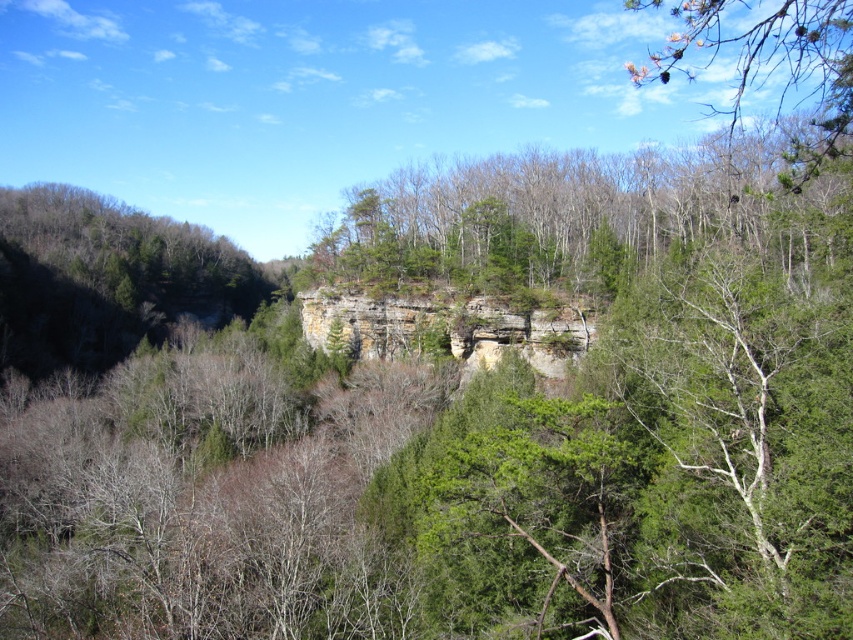
You are an artist sketching this landscape. You want to ensure the green textured pine branch at upper right and the rustic stone cliff at center are proportionally accurate. Which object should you draw taller in your sketch?

The green textured pine branch at upper right should be drawn taller than the rustic stone cliff at center because it has a greater height according to the description.

You are an ornithologist observing the landscape. You notice a green leafy tree at center and a green textured pine branch at upper right. Which of these two objects is closer to your viewpoint?

The green leafy tree at center is closer to your viewpoint because the green textured pine branch at upper right is positioned behind it.

From the picture: You are a hiker trying to navigate through the dense forest. You see a green leafy tree at center and a green textured pine branch at upper right. Which one is closer to you in size when comparing their sizes?

The green leafy tree at center is smaller than the green textured pine branch at upper right, so the pine branch is larger in size.